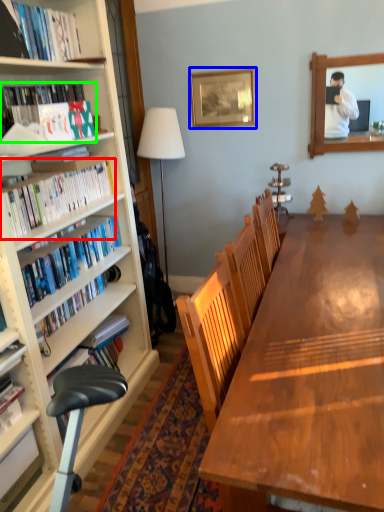
Question: Which is nearer to the book (highlighted by a red box)? picture frame (highlighted by a blue box) or book (highlighted by a green box).

Choices:
 (A) picture frame
 (B) book

Answer: (B)